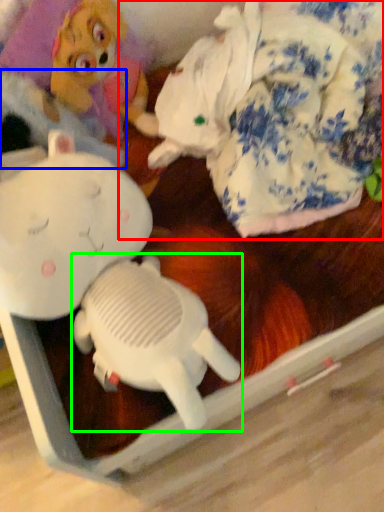
Question: Which is farther away from toy (highlighted by a red box)? clothing (highlighted by a blue box) or toy (highlighted by a green box)?

Choices:
 (A) clothing
 (B) toy

Answer: (B)